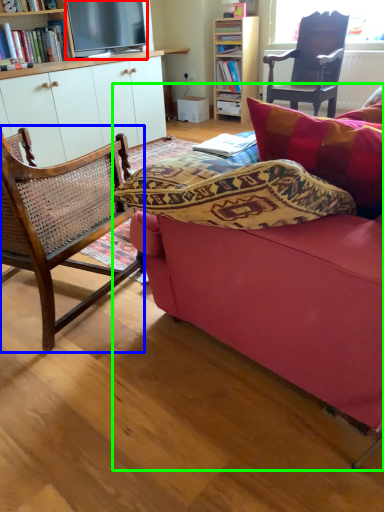
Question: Which object is the farthest from television (highlighted by a red box)? Choose among these: chair (highlighted by a blue box) or studio couch (highlighted by a green box).

Choices:
 (A) chair
 (B) studio couch

Answer: (B)